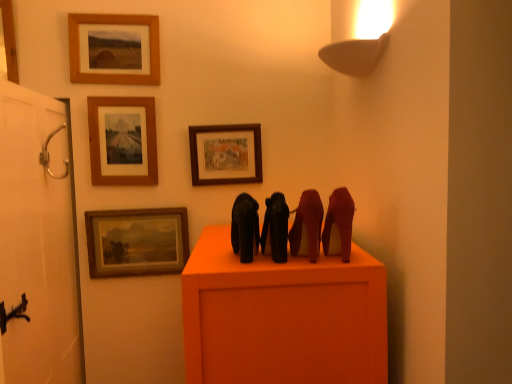
Question: Is silver metallic door handle at left taller than wooden frame at upper center, which appears as the third picture frame when viewed from the left?

Choices:
 (A) no
 (B) yes

Answer: (A)

Question: Does silver metallic door handle at left appear on the left side of wooden frame at upper center, the 3th picture frame in the right-to-left sequence?

Choices:
 (A) yes
 (B) no

Answer: (A)

Question: From a real-world perspective, is silver metallic door handle at left located beneath wooden frame at upper center, the 3th picture frame in the right-to-left sequence?

Choices:
 (A) yes
 (B) no

Answer: (A)

Question: From the image's perspective, is silver metallic door handle at left located beneath wooden frame at upper center, which appears as the third picture frame when viewed from the left?

Choices:
 (A) no
 (B) yes

Answer: (B)

Question: Is silver metallic door handle at left at the right side of wooden frame at upper center, the 3th picture frame in the right-to-left sequence?

Choices:
 (A) no
 (B) yes

Answer: (A)

Question: Based on their sizes in the image, would you say silver metallic door handle at left is bigger or smaller than wooden picture frame at upper center, the 5th picture frame viewed from the left?

Choices:
 (A) big
 (B) small

Answer: (B)

Question: Based on their positions, is silver metallic door handle at left located to the left or right of wooden picture frame at upper center, the first picture frame positioned from the right?

Choices:
 (A) left
 (B) right

Answer: (A)

Question: Relative to wooden picture frame at upper center, the first picture frame positioned from the right, is silver metallic door handle at left in front or behind?

Choices:
 (A) behind
 (B) front

Answer: (B)

Question: Choose the correct answer: Is silver metallic door handle at left inside wooden picture frame at upper center, the first picture frame positioned from the right, or outside it?

Choices:
 (A) inside
 (B) outside

Answer: (B)

Question: From a real-world perspective, is black matte elephant at center, marked as the second animal in a left-to-right arrangement, above or below wooden framed painting at lower left, arranged as the 4th picture frame when viewed from the left?

Choices:
 (A) above
 (B) below

Answer: (A)

Question: From the image's perspective, is black matte elephant at center, marked as the second animal in a left-to-right arrangement, above or below wooden framed painting at lower left, the 2th picture frame viewed from the right?

Choices:
 (A) below
 (B) above

Answer: (B)

Question: Considering the positions of black matte elephant at center, marked as the second animal in a left-to-right arrangement, and wooden framed painting at lower left, the 2th picture frame viewed from the right, in the image, is black matte elephant at center, marked as the second animal in a left-to-right arrangement, wider or thinner than wooden framed painting at lower left, the 2th picture frame viewed from the right,?

Choices:
 (A) thin
 (B) wide

Answer: (B)

Question: Looking at the image, does black matte elephant at center, marked as the 3th animal in a right-to-left arrangement, seem bigger or smaller compared to wooden framed painting at lower left, the 2th picture frame viewed from the right?

Choices:
 (A) big
 (B) small

Answer: (B)

Question: Considering the relative positions of silver metallic door handle at left and brushed metal picture frame at upper left, which appears as the 1th picture frame when viewed from the left, in the image provided, is silver metallic door handle at left to the left or to the right of brushed metal picture frame at upper left, which appears as the 1th picture frame when viewed from the left,?

Choices:
 (A) left
 (B) right

Answer: (B)

Question: Does point (47, 152) appear closer or farther from the camera than point (14, 66)?

Choices:
 (A) closer
 (B) farther

Answer: (A)